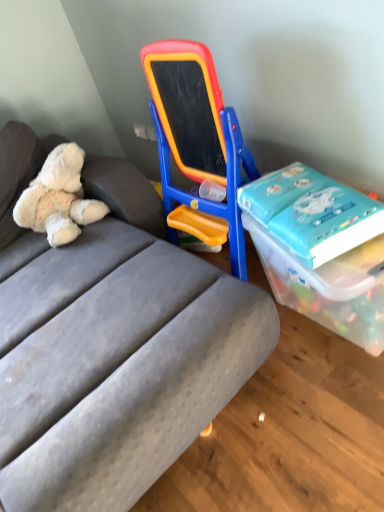
Question: Looking at the image, does gray fabric studio couch at center seem bigger or smaller compared to transparent plastic box at right?

Choices:
 (A) big
 (B) small

Answer: (A)

Question: Is point (87, 169) positioned closer to the camera than point (316, 285)?

Choices:
 (A) farther
 (B) closer

Answer: (A)

Question: Which of these objects is positioned closest to the blue glossy book at right?

Choices:
 (A) gray fabric studio couch at center
 (B) transparent plastic box at right
 (C) white plush teddy bear at left

Answer: (B)

Question: Estimate the real-world distances between objects in this image. Which object is closer to the blue glossy book at right?

Choices:
 (A) transparent plastic box at right
 (B) gray fabric studio couch at center
 (C) white plush teddy bear at left

Answer: (A)